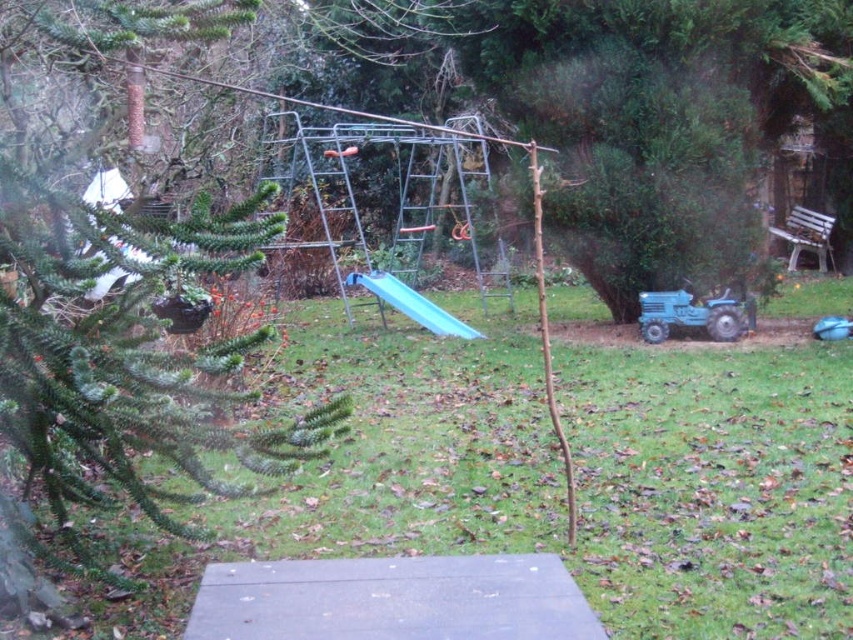
You are standing at the center of the concrete surface in the backyard. You want to place a new potted plant exactly at the midpoint between the blue matte tractor at lower right and the metal climbing frame. What are the coordinates of that midpoint?

The midpoint between the blue matte tractor at lower right and the metal climbing frame would be at coordinates calculated by averaging their positions. Since the blue matte tractor at lower right is at point (691, 314), and the metal climbing frame is centrally located, its coordinates are assumed to be around (426, 320). The midpoint would then be at approximately (559, 317).